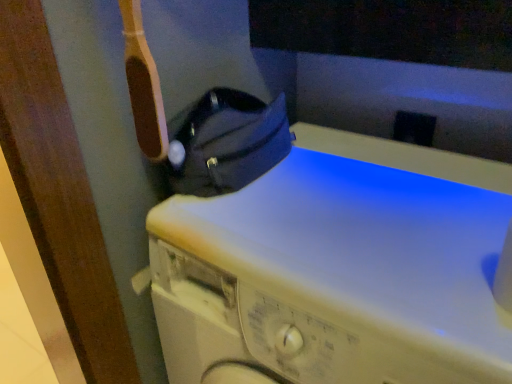
At what (x,y) coordinates should I click in order to perform the action: click on empty space that is ontop of white matte washing machine at center (from a real-world perspective). Please return your answer as a coordinate pair (x, y). Looking at the image, I should click on (359, 208).